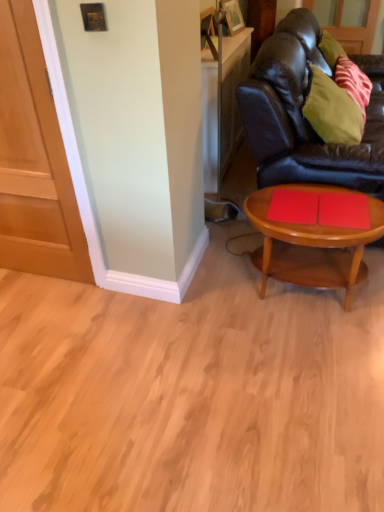
Locate an element on the screen. The width and height of the screenshot is (384, 512). free space in front of wooden coffee table at lower right is located at coordinates point(305,359).